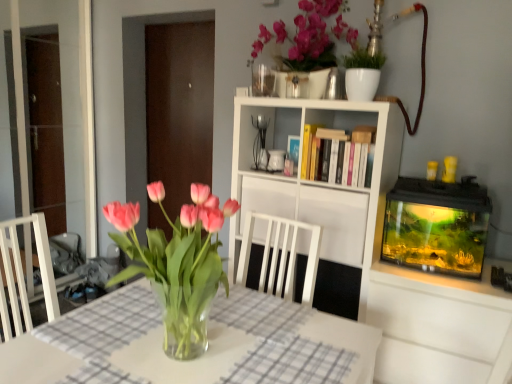
Question: Is hardcover books at center positioned in front of white matte cabinet at center?

Choices:
 (A) no
 (B) yes

Answer: (B)

Question: Is hardcover books at center taller than white matte cabinet at center?

Choices:
 (A) yes
 (B) no

Answer: (B)

Question: Could you tell me if hardcover books at center is turned towards white matte cabinet at center?

Choices:
 (A) yes
 (B) no

Answer: (B)

Question: From the image's perspective, is hardcover books at center under white matte cabinet at center?

Choices:
 (A) yes
 (B) no

Answer: (B)

Question: Is hardcover books at center thinner than white matte cabinet at center?

Choices:
 (A) no
 (B) yes

Answer: (B)

Question: Considering the relative positions of hardcover books at center and white matte cabinet at center in the image provided, is hardcover books at center to the left of white matte cabinet at center from the viewer's perspective?

Choices:
 (A) yes
 (B) no

Answer: (A)

Question: Is pink glass vase at center positioned with its back to transparent glass door at left, the second glass door from the right?

Choices:
 (A) no
 (B) yes

Answer: (A)

Question: Considering the relative sizes of pink glass vase at center and transparent glass door at left, the second glass door from the right, in the image provided, is pink glass vase at center shorter than transparent glass door at left, the second glass door from the right,?

Choices:
 (A) yes
 (B) no

Answer: (A)

Question: Is pink glass vase at center positioned behind transparent glass door at left, the second glass door from the right?

Choices:
 (A) yes
 (B) no

Answer: (B)

Question: Is the depth of pink glass vase at center less than that of transparent glass door at left, which is the 1th glass door from left to right?

Choices:
 (A) yes
 (B) no

Answer: (A)

Question: From the image's perspective, is pink glass vase at center above transparent glass door at left, the second glass door from the right?

Choices:
 (A) no
 (B) yes

Answer: (A)

Question: Can you confirm if pink glass vase at center is bigger than transparent glass door at left, which is the 1th glass door from left to right?

Choices:
 (A) no
 (B) yes

Answer: (A)

Question: Is white matte bookshelf at center positioned beyond the bounds of pink glass vase at center?

Choices:
 (A) no
 (B) yes

Answer: (B)